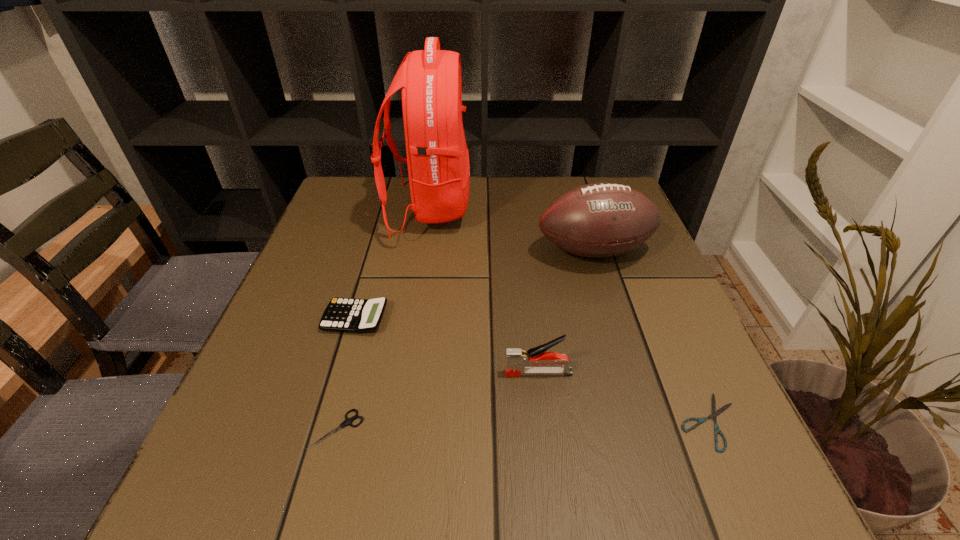
You are a GUI agent. You are given a task and a screenshot of the screen. Output one action in this format:
    pyautogui.click(x=<x>, y=<y>)
    Task: Click on the shears at the left edge
    The height and width of the screenshot is (540, 960).
    Given the screenshot: What is the action you would take?
    pyautogui.click(x=347, y=421)

The image size is (960, 540). In order to click on football (American) that is at the right edge in this screenshot , I will do `click(597, 220)`.

I want to click on shears that is at the right edge, so click(715, 413).

I want to click on free region at the far edge, so click(x=470, y=177).

The width and height of the screenshot is (960, 540). Find the location of `vacant space at the left edge of the desktop`. vacant space at the left edge of the desktop is located at coordinates pyautogui.click(x=320, y=261).

The height and width of the screenshot is (540, 960). In the image, there is a desktop. Find the location of `free space at the right edge`. free space at the right edge is located at coordinates [x=700, y=435].

Find the location of `vacant region at the far left corner of the desktop`. vacant region at the far left corner of the desktop is located at coordinates (368, 180).

Where is `vacant region at the near left corner of the desktop`? The height and width of the screenshot is (540, 960). vacant region at the near left corner of the desktop is located at coordinates (309, 469).

Find the location of `free region at the far right corner of the desktop`. free region at the far right corner of the desktop is located at coordinates (581, 186).

This screenshot has width=960, height=540. In the image, there is a desktop. In order to click on blank space at the near right corner in this screenshot , I will do `click(708, 486)`.